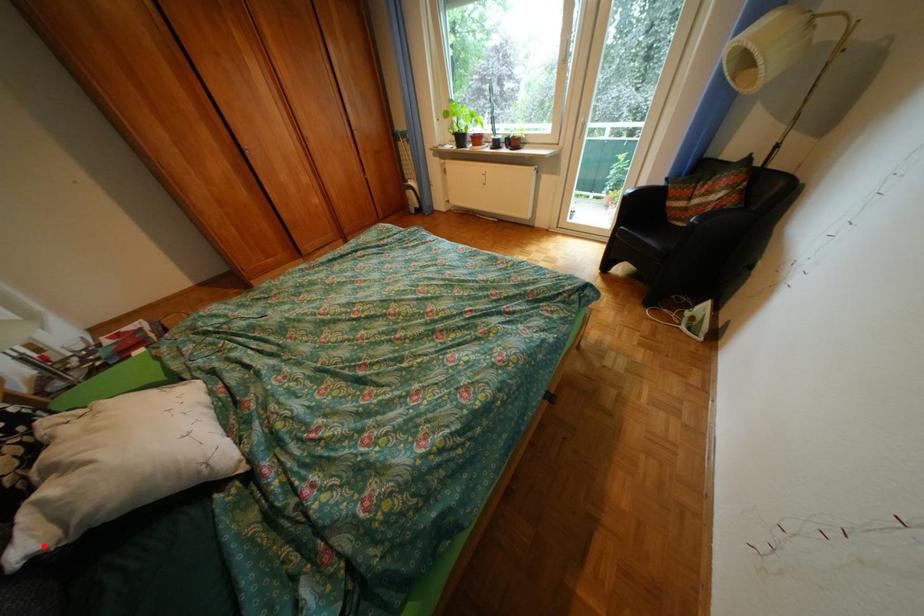
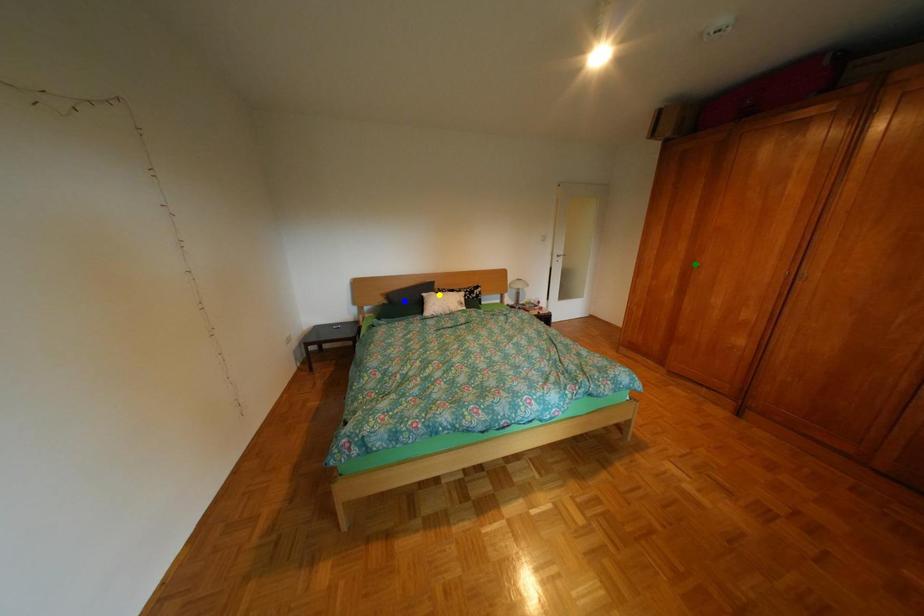
Question: I am providing you with two images of the same scene from different viewpoints. A red point is marked on the first image. You are given multiple points on the second image. Which point in image 2 is actually the same real-world point as the red point in image 1?

Choices:
 (A) blue point
 (B) green point
 (C) yellow point

Answer: (C)